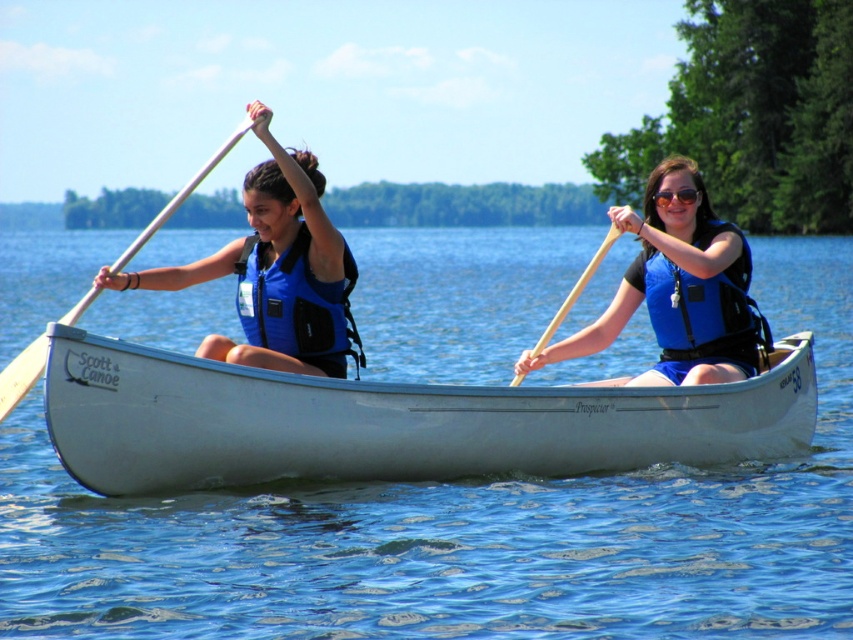
Question: Which is nearer to the wooden paddle at center?

Choices:
 (A) blue life vest at center
 (B) blue/textured life jacket at center

Answer: (B)

Question: Which of the following is the farthest from the observer?

Choices:
 (A) (45, 378)
 (B) (309, 308)
 (C) (134, 246)

Answer: (B)

Question: Among these objects, which one is farthest from the camera?

Choices:
 (A) white matte canoe at center
 (B) transparent blue water at center
 (C) wooden paddle at left
 (D) wooden paddle at center

Answer: (D)

Question: Can you confirm if blue matte life vest at left is positioned to the right of matte black goggles at center?

Choices:
 (A) yes
 (B) no

Answer: (B)

Question: Is blue matte life vest at left thinner than wooden paddle at left?

Choices:
 (A) yes
 (B) no

Answer: (A)

Question: Is blue matte life vest at left to the right of matte black goggles at center from the viewer's perspective?

Choices:
 (A) no
 (B) yes

Answer: (A)